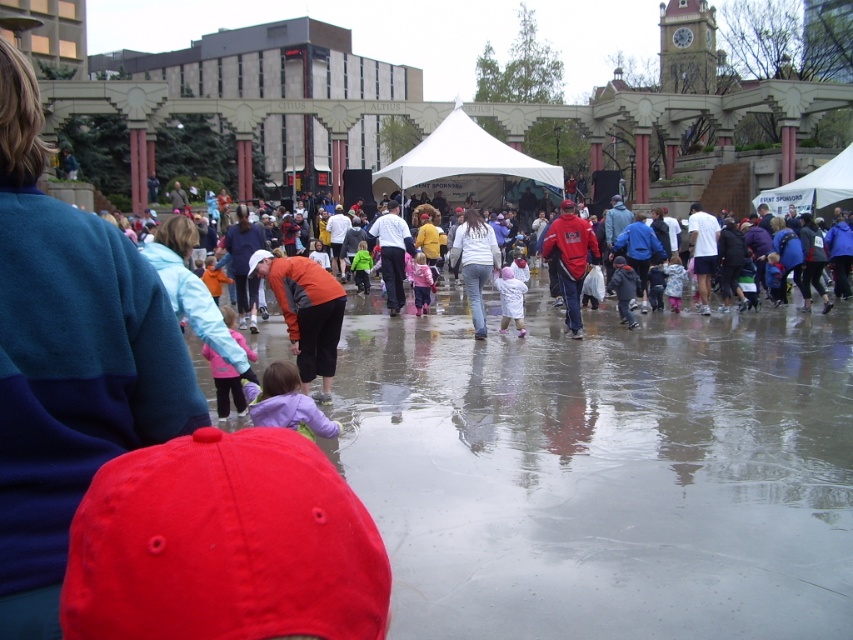
You are organizing a photo shoot and need to ensure that all clothing items in the scene are visible. Given that the purple fleece jacket at center and the red fabric jacket at center are both in the frame, which jacket might require more careful positioning to ensure it doesn not get obscured?

The purple fleece jacket at center occupies less space than the red fabric jacket at center, so it might require more careful positioning to ensure it doesn not get obscured.